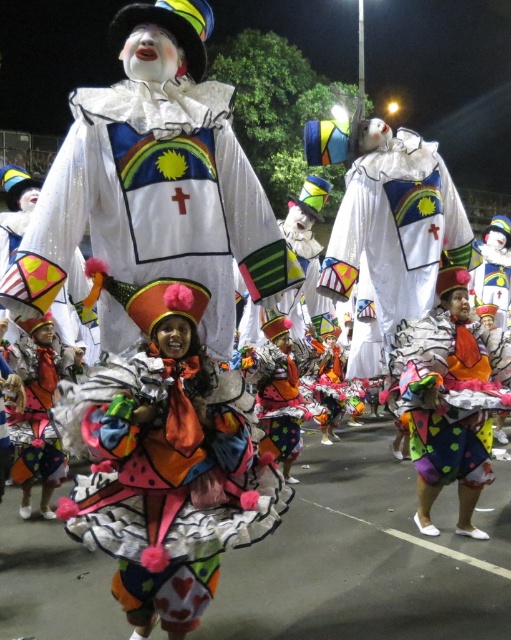
You are a photographer at the parade and want to capture both the white glittery clown at center and the white matte clown at center in a single shot. Which clown will appear closer to the camera in the photo?

The white glittery clown at center will appear closer to the camera because it is positioned under the white matte clown at center, meaning it is in front of the other.

You are a photographer at the parade and want to capture both the white matte clown at center and the multicolored fabric doll at center in a single frame. Which object should you focus on first to ensure both are in the shot?

The white matte clown at center is taller than the multicolored fabric doll at center, so focusing on the taller clown first will ensure both are in the frame.